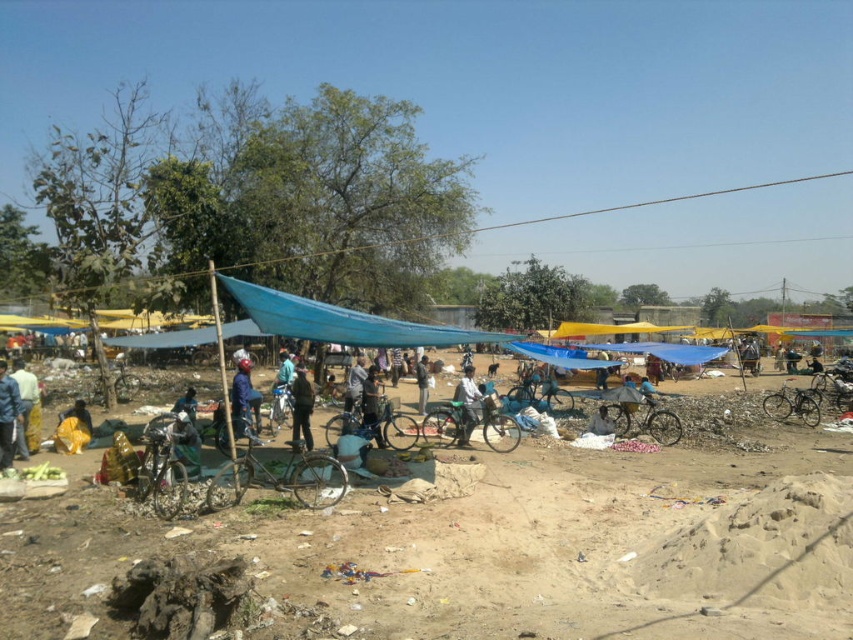
Question: Among these objects, which one is nearest to the camera?

Choices:
 (A) dark brown leather jacket at center
 (B) blue fabric at center
 (C) blue fabric canopy at center

Answer: (C)

Question: Is blue fabric at center closer to the viewer compared to dark brown leather jacket at center?

Choices:
 (A) no
 (B) yes

Answer: (A)

Question: Estimate the real-world distances between objects in this image. Which object is closer to the blue fabric jacket at left?

Choices:
 (A) brown sandy dirt field at center
 (B) blue fabric at center

Answer: (B)

Question: Does blue fabric at center appear under dark blue fabric at center?

Choices:
 (A) yes
 (B) no

Answer: (B)

Question: Is brown sandy dirt field at center to the right of dark blue fabric at center from the viewer's perspective?

Choices:
 (A) no
 (B) yes

Answer: (B)

Question: Estimate the real-world distances between objects in this image. Which object is closer to the blue fabric jacket at left?

Choices:
 (A) blue fabric at center
 (B) dark blue fabric at center

Answer: (A)